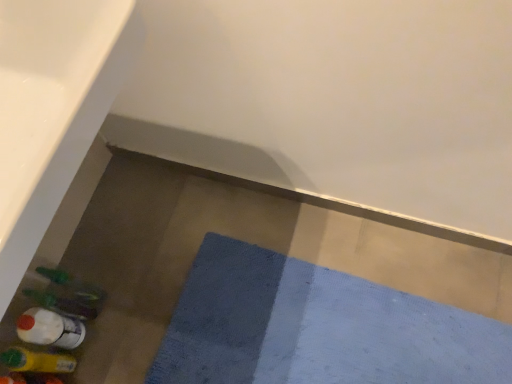
Find the location of `free space behind translucent plastic bottle at lower left, arranged as the first bottle when viewed from the top`. free space behind translucent plastic bottle at lower left, arranged as the first bottle when viewed from the top is located at coordinates (99, 252).